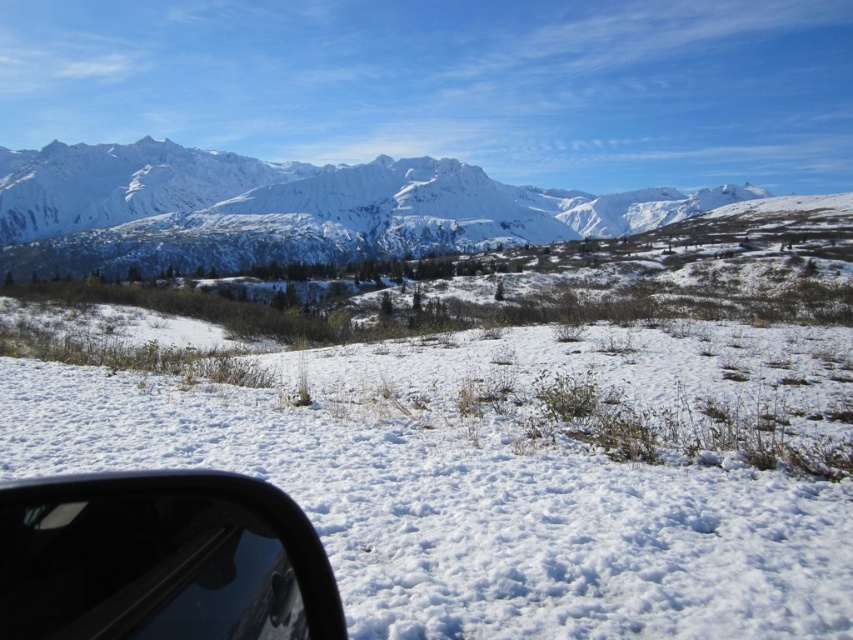
You are a photographer trying to capture the white fluffy snow at center and the black matte car window at lower left in the same frame. Based on their sizes in the image, which object would appear larger in your photo?

The white fluffy snow at center would appear larger in the photo since it is bigger than the black matte car window at lower left according to the description.

You are an explorer trying to navigate through the winter landscape. You see the white fluffy snow at center and the snowy granite mountain range at upper left. Which object is positioned to the right of the other?

A: The white fluffy snow at center is to the right of the snowy granite mountain range at upper left.